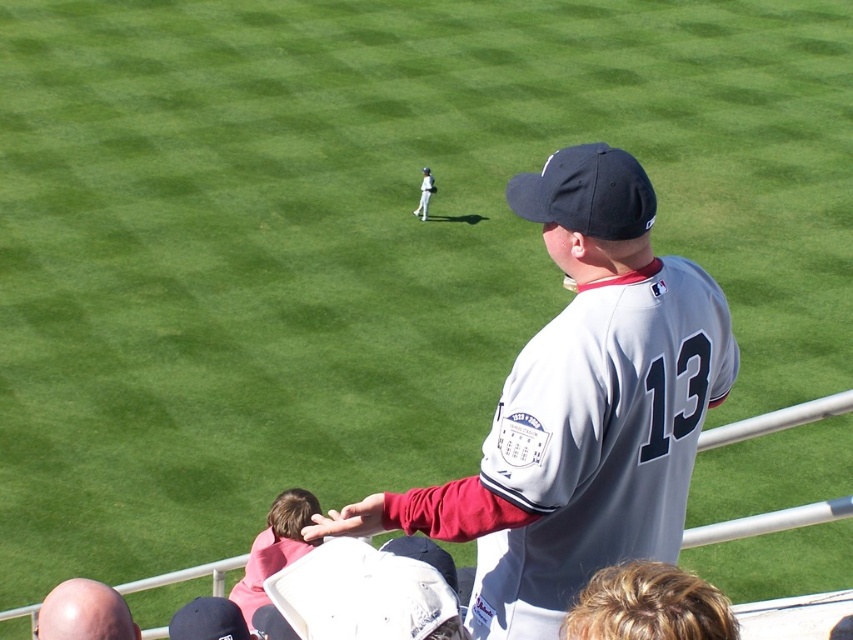
Question: Which of the following is the farthest from the observer?

Choices:
 (A) (268, 531)
 (B) (422, 205)

Answer: (B)

Question: Can you confirm if gray fabric baseball jersey at center is positioned to the left of pink fabric shirt at lower center?

Choices:
 (A) no
 (B) yes

Answer: (A)

Question: Which point is closer to the camera?

Choices:
 (A) (418, 200)
 (B) (93, 611)
 (C) (631, 577)
 (D) (494, 605)

Answer: (C)

Question: Does pink fabric shirt at lower center appear on the left side of white uniformed player at center?

Choices:
 (A) no
 (B) yes

Answer: (B)

Question: Is pink fabric shirt at lower center closer to camera compared to bald head at lower left?

Choices:
 (A) no
 (B) yes

Answer: (A)

Question: Which point appears closest to the camera in this image?

Choices:
 (A) (253, 561)
 (B) (109, 616)
 (C) (550, 580)
 (D) (636, 580)

Answer: (D)